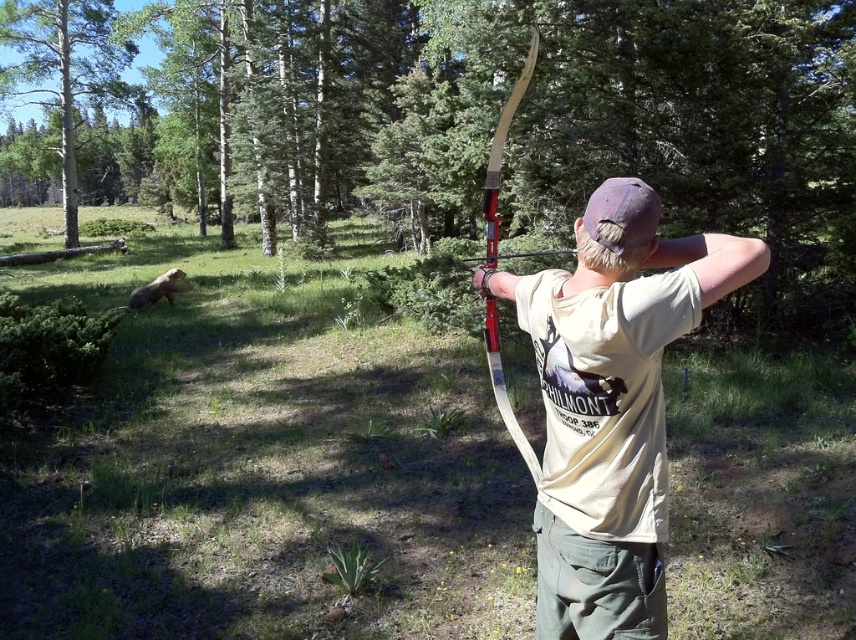
Question: Observing the image, what is the correct spatial positioning of matte khaki shirt at center in reference to wooden bow at center?

Choices:
 (A) below
 (B) above

Answer: (A)

Question: Is green leafy tree at center to the right of green leafy tree at left from the viewer's perspective?

Choices:
 (A) no
 (B) yes

Answer: (B)

Question: Which is farther from the green leafy tree at center?

Choices:
 (A) matte khaki shirt at center
 (B) wooden bow at center

Answer: (B)

Question: Can you confirm if matte khaki shirt at center is bigger than green leafy tree at left?

Choices:
 (A) yes
 (B) no

Answer: (A)

Question: Among these objects, which one is farthest from the camera?

Choices:
 (A) matte khaki shirt at center
 (B) green leafy tree at left
 (C) green leafy tree at center
 (D) wooden bow at center

Answer: (B)

Question: Which of the following is the farthest from the observer?

Choices:
 (A) (9, 36)
 (B) (524, 86)
 (C) (524, 296)
 (D) (629, 102)

Answer: (A)